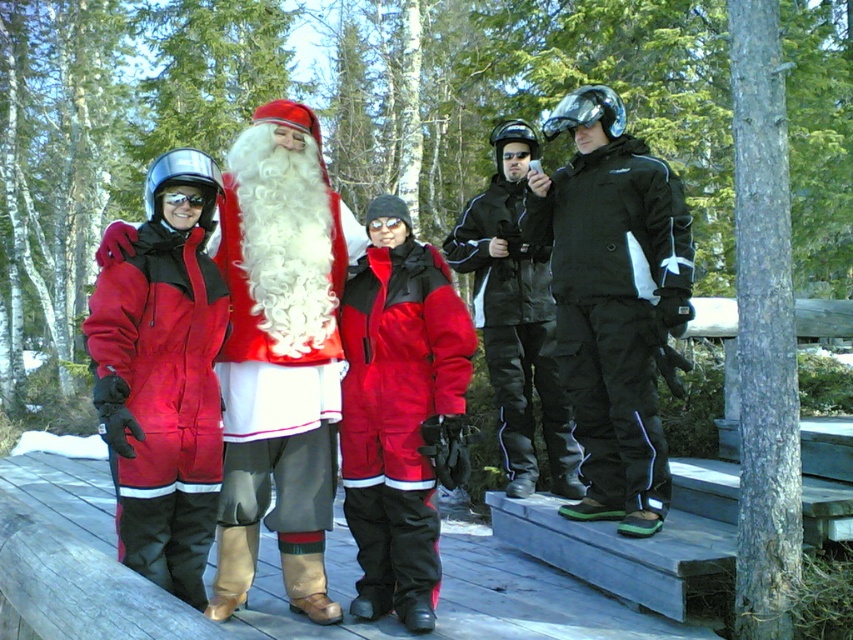
Who is more forward, (x=625, y=397) or (x=366, y=264)?

Point (x=366, y=264)

Does matte black ski suit at center have a greater width compared to matte red snowsuit at center?

Correct, the width of matte black ski suit at center exceeds that of matte red snowsuit at center.

Does point (666, 266) lie behind point (350, 529)?

Yes, it is behind point (350, 529).

Find the location of a particular element. This screenshot has height=640, width=853. matte black ski suit at center is located at coordinates (613, 301).

Between matte black ski suit at center and matte red snowsuit at left, which one has more height?

matte black ski suit at center is taller.

Is matte black ski suit at center below matte red snowsuit at left?

Incorrect, matte black ski suit at center is not positioned below matte red snowsuit at left.

Which is in front, point (643, 332) or point (189, 445)?

Point (189, 445) is in front.

Where is `matte black ski suit at center`? This screenshot has height=640, width=853. matte black ski suit at center is located at coordinates (613, 301).

Between red velvet santa at left and black waterproof jacket at center, which one is positioned higher?

Positioned higher is black waterproof jacket at center.

Where is `red velvet santa at left`? red velvet santa at left is located at coordinates (280, 355).